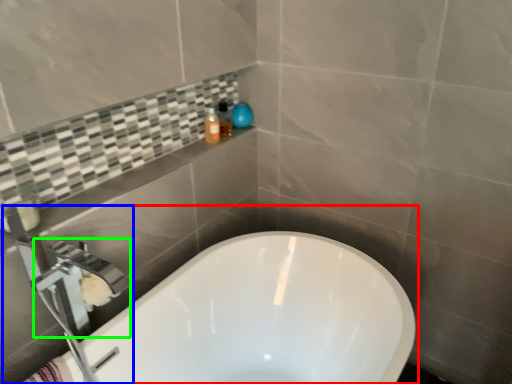
Question: Based on their relative distances, which object is farther from bathtub (highlighted by a red box)? Choose from tap (highlighted by a blue box) and faucet (highlighted by a green box).

Choices:
 (A) tap
 (B) faucet

Answer: (B)